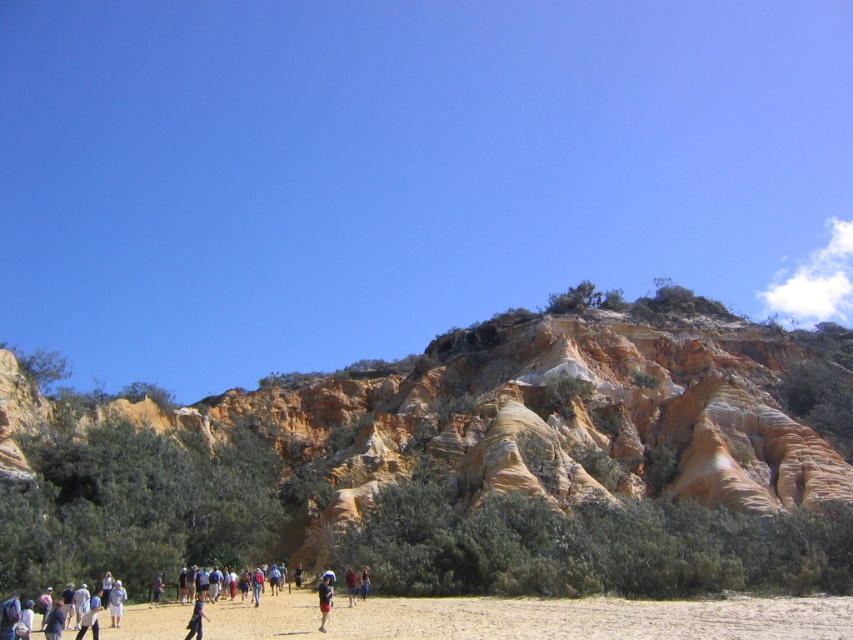
You are a photographer trying to capture a wide shot of the light brown sand at lower center and the dark blue jeans at center. Which object should you focus on first if you want to include both in your frame?

Since the light brown sand at lower center might be wider than the dark blue jeans at center, you should focus on the light brown sand at lower center first to ensure it fits within the frame.

You are a photographer trying to capture a photo of the dark blue jeans at center and blue denim shorts at center. Which object should you focus on if you want to ensure both are in the frame without moving the camera?

Both the dark blue jeans at center and the blue denim shorts at center are positioned at the center of the image, so focusing on either will keep both in the frame without needing to move the camera.

You are a photographer trying to capture the entire group of people in the foreground. Your camera has a fixed focus point at the center of the frame. Given that the dark blue jeans at center are exactly at the center, will the people around them be in focus?

The dark blue jeans at center are at the center point, so the people around them may be in focus depending on the camera aperture and depth of field, but the question does not provide enough information about these factors to determine for certain.